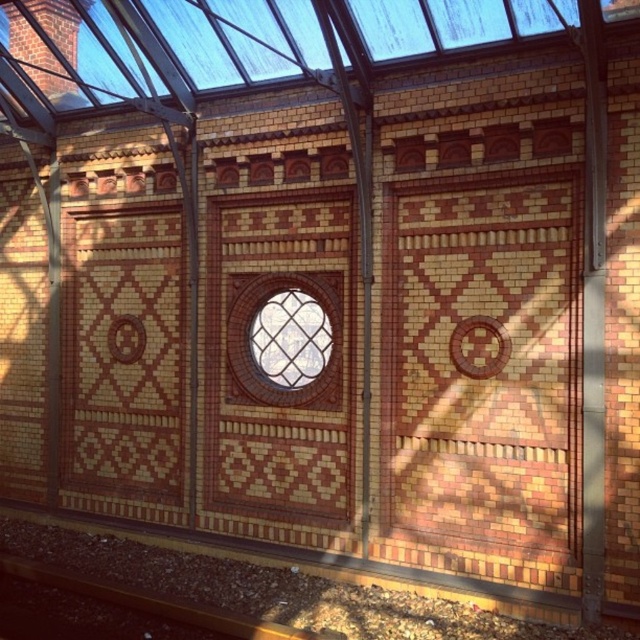
What do you see at coordinates (252, 349) in the screenshot?
I see `clear glass window at center` at bounding box center [252, 349].

Between clear glass window at center and brown gravel at bottom, which one has more height?

clear glass window at center is taller.

Image resolution: width=640 pixels, height=640 pixels. Describe the element at coordinates (252, 349) in the screenshot. I see `clear glass window at center` at that location.

You are a GUI agent. You are given a task and a screenshot of the screen. Output one action in this format:
    pyautogui.click(x=<x>, y=<y>)
    Task: Click on the clear glass window at center
    This screenshot has height=640, width=640.
    Given the screenshot: What is the action you would take?
    pyautogui.click(x=252, y=349)